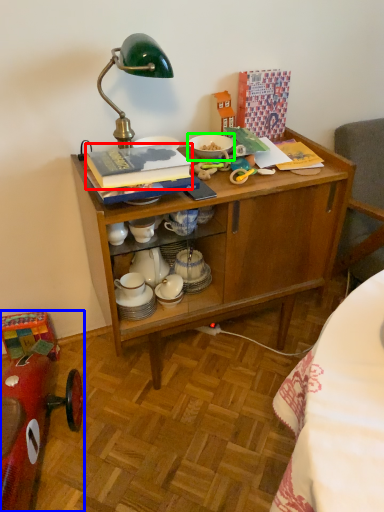
Question: Which object is the farthest from book (highlighted by a red box)? Choose among these: model car (highlighted by a blue box) or tableware (highlighted by a green box).

Choices:
 (A) model car
 (B) tableware

Answer: (A)